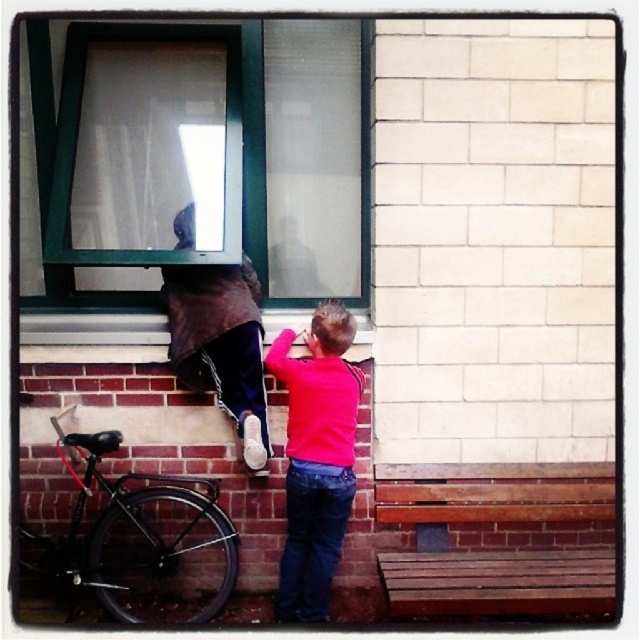
Describe the element at coordinates (211, 160) in the screenshot. The width and height of the screenshot is (640, 640). I see `green frame glass window at upper center` at that location.

Which of these two, green frame glass window at upper center or brown fabric at upper center, stands taller?

Standing taller between the two is green frame glass window at upper center.

Is point (168, 260) positioned in front of point (228, 268)?

Yes, point (168, 260) is closer to viewer.

Where is `green frame glass window at upper center`? This screenshot has height=640, width=640. green frame glass window at upper center is located at coordinates (211, 160).

Which of these two, green frame glass window at upper center or pink matte sweater at center, stands taller?

green frame glass window at upper center

Is point (268, 154) closer to viewer compared to point (348, 468)?

No, it is behind (348, 468).

Image resolution: width=640 pixels, height=640 pixels. Describe the element at coordinates (211, 160) in the screenshot. I see `green frame glass window at upper center` at that location.

The width and height of the screenshot is (640, 640). I want to click on green frame glass window at upper center, so click(x=211, y=160).

Who is positioned more to the left, black matte bicycle at lower left or pink matte sweater at center?

black matte bicycle at lower left

Is black matte bicycle at lower left below pink matte sweater at center?

Correct, black matte bicycle at lower left is located below pink matte sweater at center.

Who is more distant from viewer, (188, 573) or (332, 380)?

The point (188, 573) is more distant.

This screenshot has height=640, width=640. What are the coordinates of `black matte bicycle at lower left` in the screenshot? It's located at (141, 540).